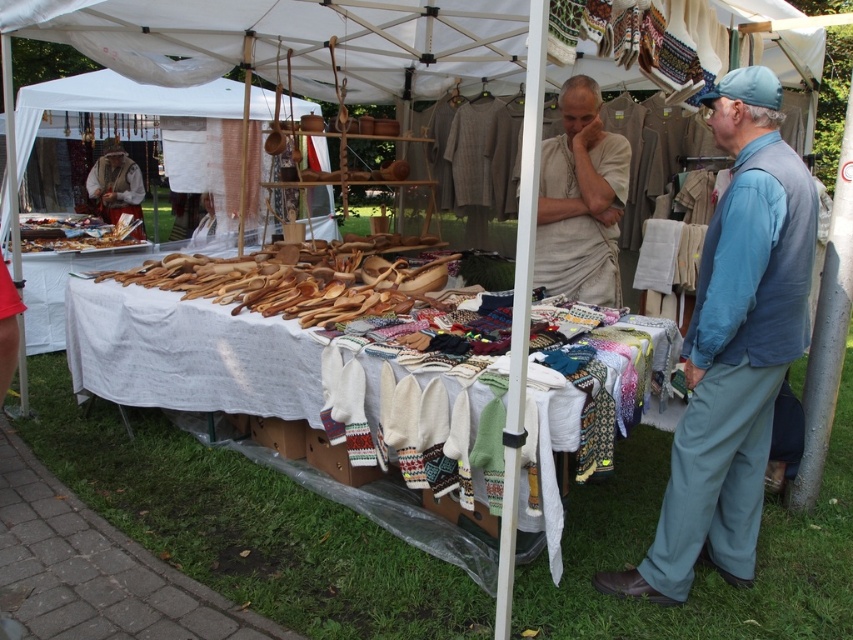
Is point (693, 404) closer to camera compared to point (206, 236)?

Yes, point (693, 404) is closer to viewer.

Can you confirm if blue cotton vest at right is bigger than white knitted mittens at center?

Correct, blue cotton vest at right is larger in size than white knitted mittens at center.

Does point (747, 332) come in front of point (196, 227)?

Yes, it is in front of point (196, 227).

This screenshot has height=640, width=853. I want to click on blue cotton vest at right, so click(x=735, y=368).

Based on the photo, does beige linen shirt at center have a greater height compared to red fabric dress at lower left?

Yes, beige linen shirt at center is taller than red fabric dress at lower left.

In the scene shown: Is beige linen shirt at center below red fabric dress at lower left?

No, beige linen shirt at center is not below red fabric dress at lower left.

What do you see at coordinates (572, 236) in the screenshot?
I see `beige linen shirt at center` at bounding box center [572, 236].

Where is `beige linen shirt at center`? beige linen shirt at center is located at coordinates (572, 236).

Can you confirm if blue cotton vest at right is positioned to the left of red fabric dress at lower left?

In fact, blue cotton vest at right is to the right of red fabric dress at lower left.

Between point (676, 486) and point (3, 280), which one is positioned in front?

Point (3, 280) is in front.

You are a GUI agent. You are given a task and a screenshot of the screen. Output one action in this format:
    pyautogui.click(x=<x>, y=<y>)
    Task: Click on the blue cotton vest at right
    Image resolution: width=853 pixels, height=640 pixels.
    Given the screenshot: What is the action you would take?
    pyautogui.click(x=735, y=368)